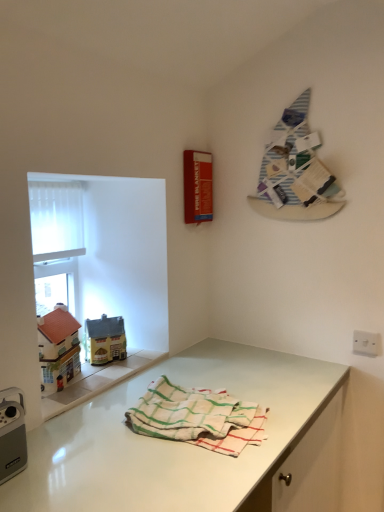
Question: Considering the relative sizes of white woven towel at center and white translucent screen at upper left in the image provided, is white woven towel at center bigger than white translucent screen at upper left?

Choices:
 (A) yes
 (B) no

Answer: (A)

Question: Are white woven towel at center and white translucent screen at upper left beside each other?

Choices:
 (A) yes
 (B) no

Answer: (B)

Question: From a real-world perspective, is white woven towel at center on top of white translucent screen at upper left?

Choices:
 (A) no
 (B) yes

Answer: (A)

Question: From the image's perspective, is white woven towel at center over white translucent screen at upper left?

Choices:
 (A) no
 (B) yes

Answer: (A)

Question: Does white woven towel at center have a greater width compared to white translucent screen at upper left?

Choices:
 (A) yes
 (B) no

Answer: (A)

Question: Does point (188, 472) appear closer or farther from the camera than point (140, 415)?

Choices:
 (A) closer
 (B) farther

Answer: (A)

Question: Considering their positions, is white glossy countertop at lower center located in front of or behind white woven towel at center?

Choices:
 (A) behind
 (B) front

Answer: (B)

Question: Is white glossy countertop at lower center spatially inside white woven towel at center, or outside of it?

Choices:
 (A) outside
 (B) inside

Answer: (A)

Question: In terms of height, does white glossy countertop at lower center look taller or shorter compared to white woven towel at center?

Choices:
 (A) tall
 (B) short

Answer: (A)

Question: Is white plastic switch at lower right wider or thinner than matte plastic toy house at left, the 1th toy when ordered from left to right?

Choices:
 (A) thin
 (B) wide

Answer: (A)

Question: Considering their positions, is white plastic switch at lower right located in front of or behind matte plastic toy house at left, the 1th toy when ordered from left to right?

Choices:
 (A) behind
 (B) front

Answer: (A)

Question: Considering the relative positions of white plastic switch at lower right and matte plastic toy house at left, the 1th toy when ordered from left to right, in the image provided, is white plastic switch at lower right to the left or to the right of matte plastic toy house at left, the 1th toy when ordered from left to right,?

Choices:
 (A) left
 (B) right

Answer: (B)

Question: Is white plastic switch at lower right inside the boundaries of matte plastic toy house at left, the second toy from the back, or outside?

Choices:
 (A) outside
 (B) inside

Answer: (A)

Question: Looking at their shapes, would you say white glossy countertop at lower center is wider or thinner than white plastic switch at lower right?

Choices:
 (A) wide
 (B) thin

Answer: (A)

Question: Would you say white glossy countertop at lower center is to the left or to the right of white plastic switch at lower right in the picture?

Choices:
 (A) left
 (B) right

Answer: (A)